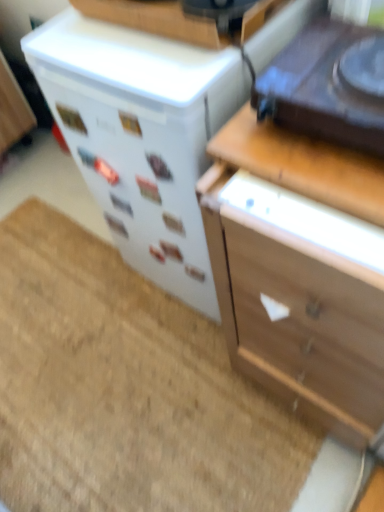
Question: Can you see wooden at upper right touching beige carpet at lower left?

Choices:
 (A) no
 (B) yes

Answer: (A)

Question: Would you say beige carpet at lower left is part of wooden at upper right's contents?

Choices:
 (A) yes
 (B) no

Answer: (B)

Question: Is wooden at upper right aimed at beige carpet at lower left?

Choices:
 (A) no
 (B) yes

Answer: (A)

Question: From a real-world perspective, is wooden at upper right below beige carpet at lower left?

Choices:
 (A) no
 (B) yes

Answer: (A)

Question: From the image's perspective, is wooden at upper right located above beige carpet at lower left?

Choices:
 (A) no
 (B) yes

Answer: (B)

Question: Is wooden at upper right taller than beige carpet at lower left?

Choices:
 (A) no
 (B) yes

Answer: (B)

Question: From a real-world perspective, does wooden at upper right sit lower than shiny black turntable at upper right, which is the 2th appliance from back to front?

Choices:
 (A) no
 (B) yes

Answer: (B)

Question: Considering the relative sizes of wooden at upper right and shiny black turntable at upper right, which is the 2th appliance from back to front, in the image provided, is wooden at upper right bigger than shiny black turntable at upper right, which is the 2th appliance from back to front,?

Choices:
 (A) no
 (B) yes

Answer: (A)

Question: Is wooden at upper right wider than shiny black turntable at upper right, which is the 2th appliance from back to front?

Choices:
 (A) no
 (B) yes

Answer: (A)

Question: From a real-world perspective, does wooden at upper right stand above shiny black turntable at upper right, which is the first appliance from front to back?

Choices:
 (A) yes
 (B) no

Answer: (B)

Question: Is wooden at upper right facing away from shiny black turntable at upper right, which is the first appliance from front to back?

Choices:
 (A) no
 (B) yes

Answer: (A)

Question: From the image's perspective, is wooden at upper right located beneath shiny black turntable at upper right, which is the 2th appliance from back to front?

Choices:
 (A) no
 (B) yes

Answer: (B)

Question: Does white glossy refrigerator at center-left, which ranks as the first appliance in back-to-front order, have a greater width compared to wooden at upper right?

Choices:
 (A) yes
 (B) no

Answer: (A)